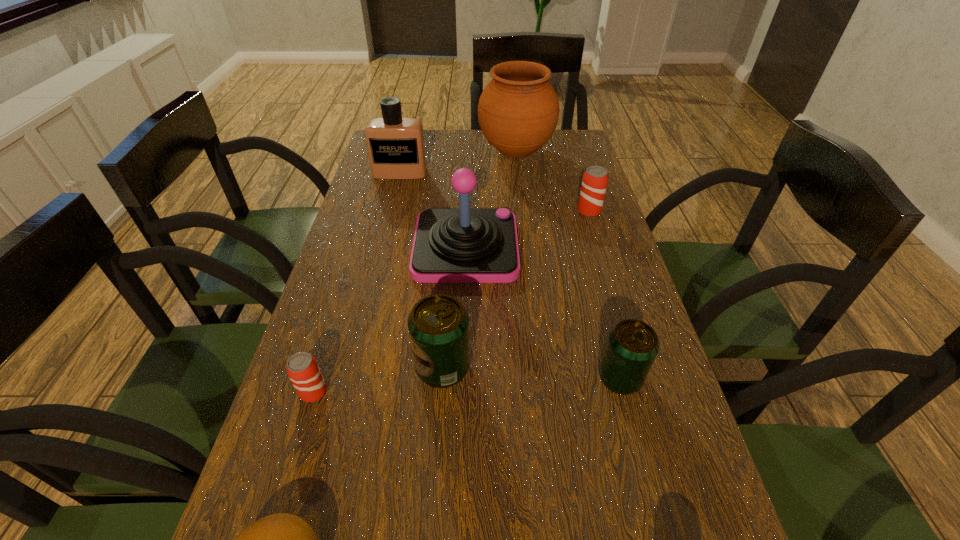
What are the coordinates of `free space located 0.050m on the left of the pottery` in the screenshot? It's located at [x=464, y=152].

The height and width of the screenshot is (540, 960). What are the coordinates of `vacant space located 0.310m on the front label of the beige perfume` in the screenshot? It's located at (383, 242).

Find the location of `vacant space located forward from the base of the joystick`. vacant space located forward from the base of the joystick is located at coordinates (537, 247).

Find the location of a particular element. free space located 0.250m on the front of the tallest beer can is located at coordinates (431, 536).

Find the location of a particular element. This screenshot has width=960, height=540. vacant space located 0.050m on the left of the bigger orange beer can is located at coordinates (560, 211).

This screenshot has height=540, width=960. Find the location of `vacant space located 0.220m on the front of the right green beer can`. vacant space located 0.220m on the front of the right green beer can is located at coordinates (660, 523).

Locate an element on the screen. The height and width of the screenshot is (540, 960). free space located on the back of the nearer orange beer can is located at coordinates [343, 296].

Where is `object situated at the far edge`? Image resolution: width=960 pixels, height=540 pixels. object situated at the far edge is located at coordinates (518, 111).

Identify the location of perfume positioned at the left edge. (395, 144).

In order to click on beer can that is at the left edge in this screenshot , I will do `click(302, 368)`.